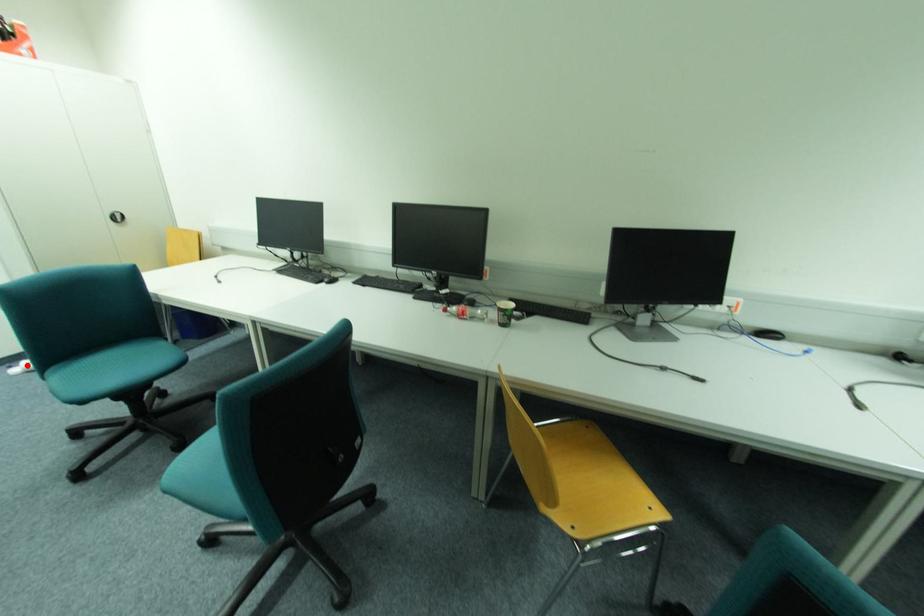
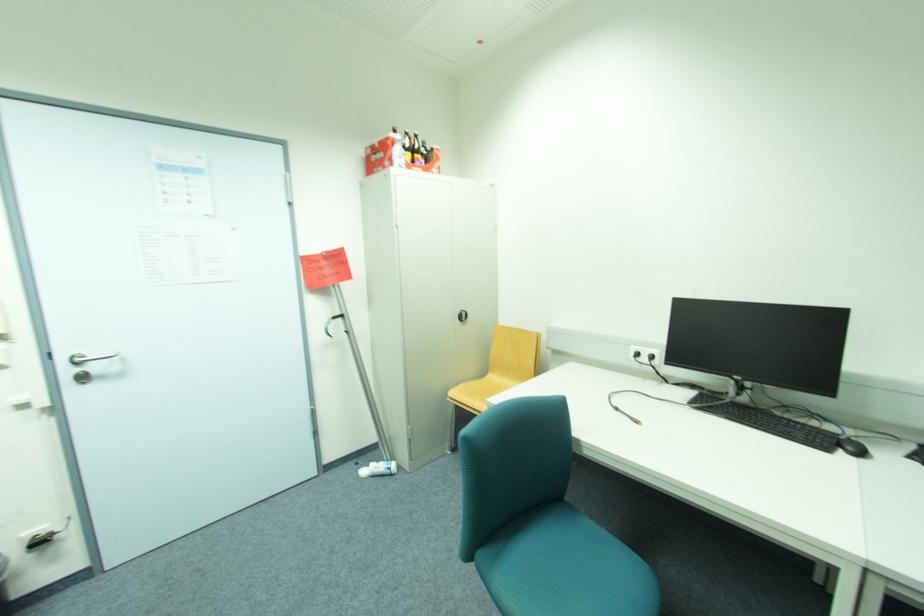
Locate, in the second image, the point that corresponds to the highlighted location in the first image.

(373, 468)